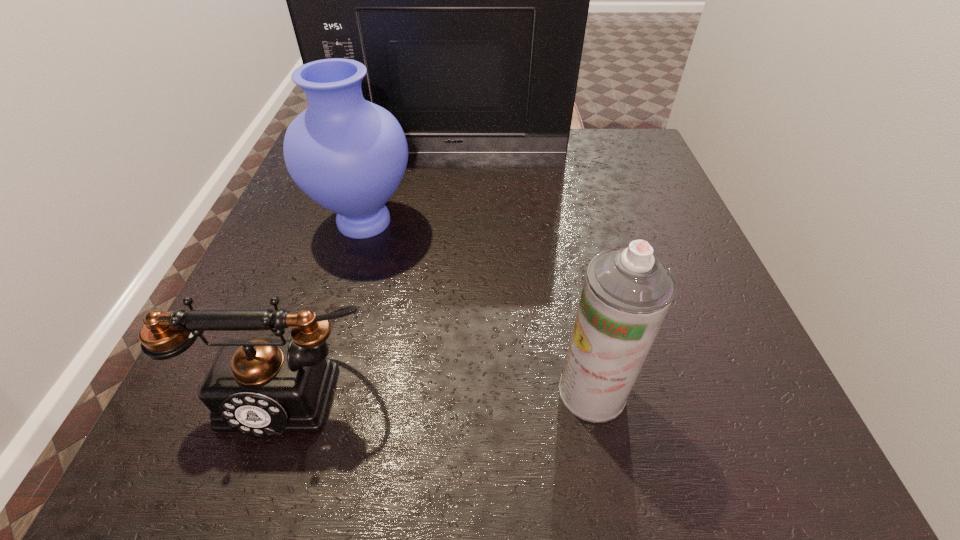
Locate an element on the screen. Image resolution: width=960 pixels, height=540 pixels. telephone situated at the near edge is located at coordinates pos(262,386).

The height and width of the screenshot is (540, 960). I want to click on microwave oven located at the left edge, so click(468, 0).

Identify the location of vase that is at the left edge. The image size is (960, 540). (349, 155).

What are the coordinates of `telephone at the left edge` in the screenshot? It's located at 262,386.

At what (x,y) coordinates should I click in order to perform the action: click on object that is at the far left corner. Please return your answer as a coordinate pair (x, y). This screenshot has height=540, width=960. Looking at the image, I should click on (468, 0).

Where is `object present at the near left corner`? This screenshot has width=960, height=540. object present at the near left corner is located at coordinates (262, 386).

Image resolution: width=960 pixels, height=540 pixels. In the image, there is a desktop. In order to click on free region at the far edge in this screenshot , I will do `click(491, 160)`.

In order to click on vacant space at the near edge of the desktop in this screenshot , I will do `click(612, 421)`.

Locate an element on the screen. The width and height of the screenshot is (960, 540). vacant point at the right edge is located at coordinates (662, 203).

Where is `free location at the near left corner of the desktop`? free location at the near left corner of the desktop is located at coordinates (217, 463).